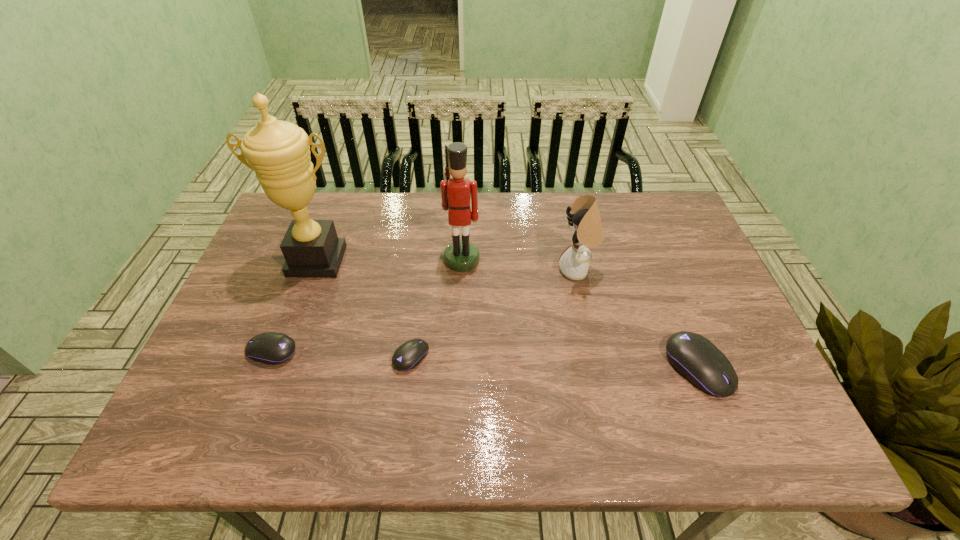
To achieve even spacing by inserting another mouse_(computer_equipment) among them, please point to a vacant spot for this new mouse_(computer_equipment). Please provide its 2D coordinates. Your answer should be formatted as a tuple, i.e. [(x, y)], where the tuple contains the x and y coordinates of a point satisfying the conditions above.

[(553, 362)]